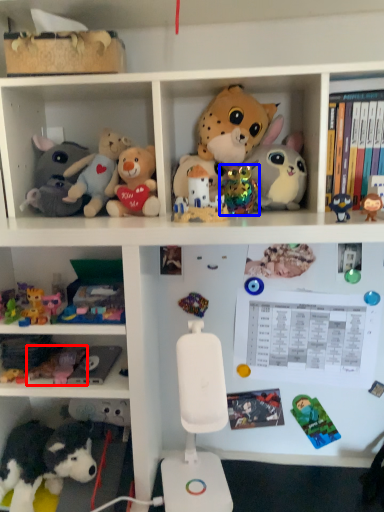
Question: Which of the following is the closest to the observer, toy (highlighted by a red box) or toy (highlighted by a blue box)?

Choices:
 (A) toy
 (B) toy

Answer: (A)